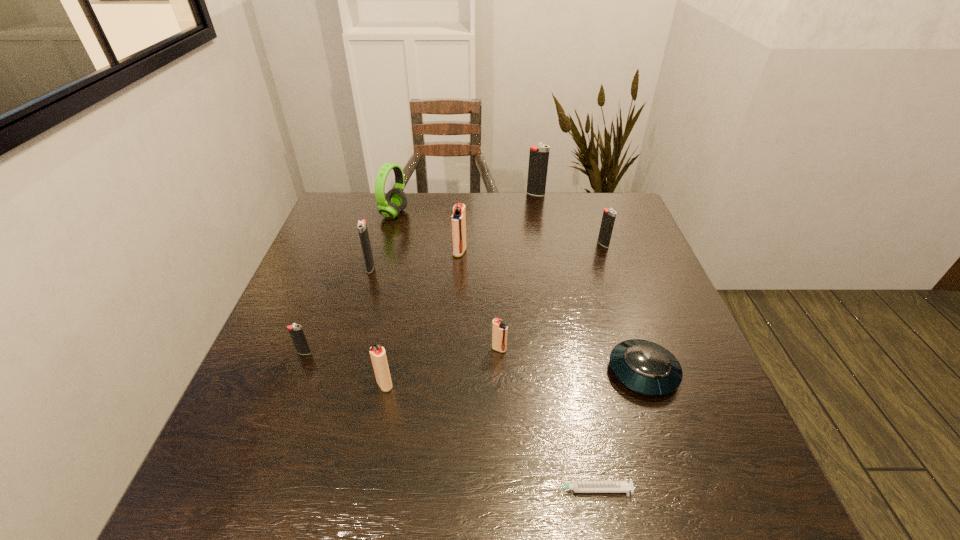
Identify the location of the second smallest red igniter. The height and width of the screenshot is (540, 960). (377, 353).

Find the location of a particular element. The width and height of the screenshot is (960, 540). the fourth object from left to right is located at coordinates (377, 353).

Where is `the smallest red igniter`? The image size is (960, 540). the smallest red igniter is located at coordinates 499,330.

Locate an element on the screen. The width and height of the screenshot is (960, 540). the second farthest red igniter is located at coordinates (499, 330).

Locate an element on the screen. Image resolution: width=960 pixels, height=540 pixels. the leftmost black igniter is located at coordinates (295, 330).

At what (x,y) coordinates should I click in order to perform the action: click on the nearest black igniter. Please return your answer as a coordinate pair (x, y). This screenshot has height=540, width=960. Looking at the image, I should click on (295, 330).

Identify the location of the ninth tallest object. (645, 367).

This screenshot has height=540, width=960. What are the coordinates of `saucer` in the screenshot? It's located at (645, 367).

The width and height of the screenshot is (960, 540). What are the coordinates of `white syringe` in the screenshot? It's located at (577, 486).

Locate an element on the screen. the shortest object is located at coordinates (577, 486).